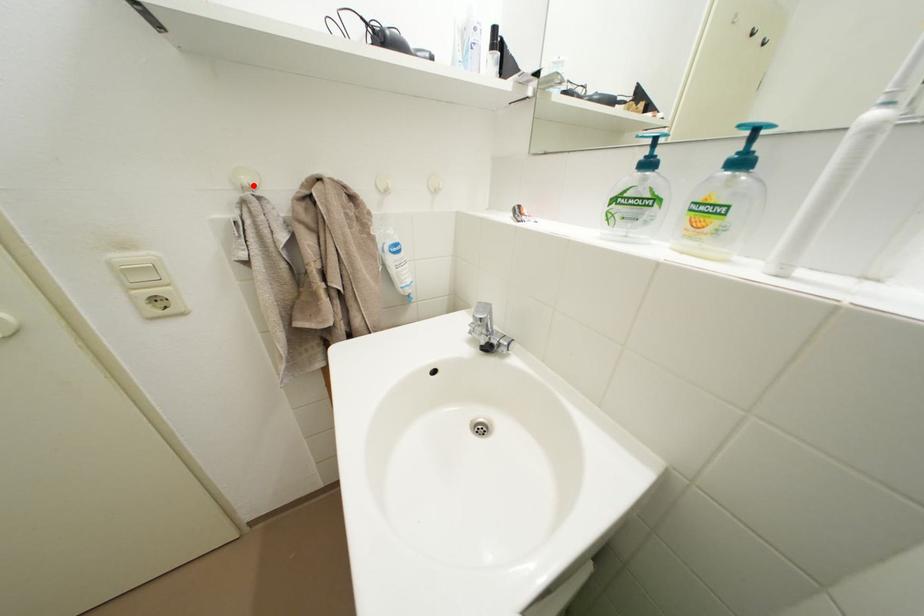
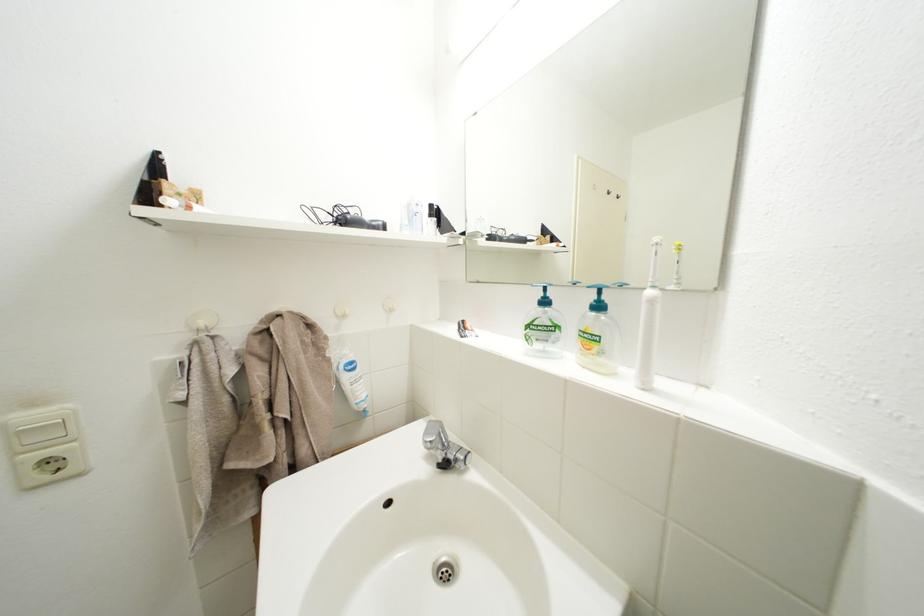
Find the pixel in the second image that matches the highlighted location in the first image.

(211, 329)